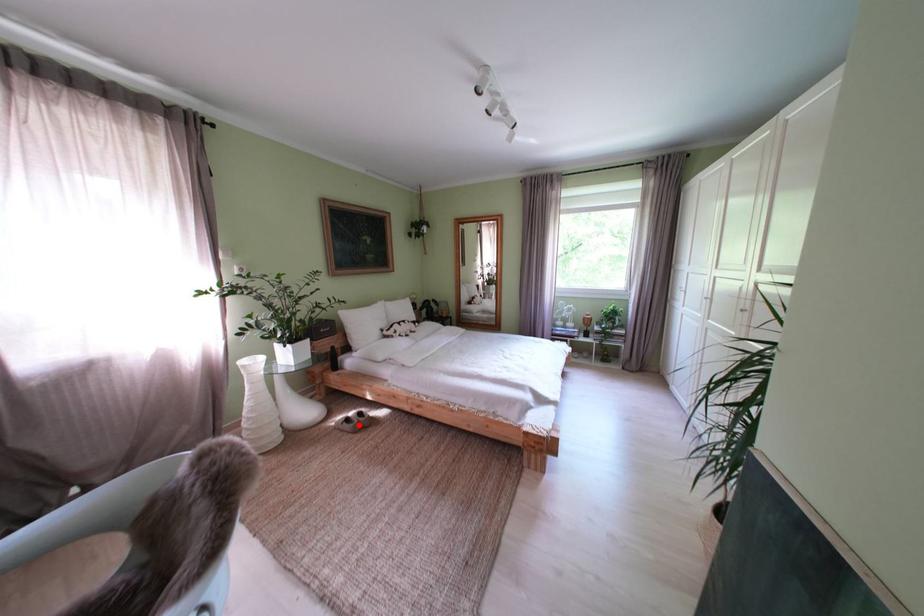
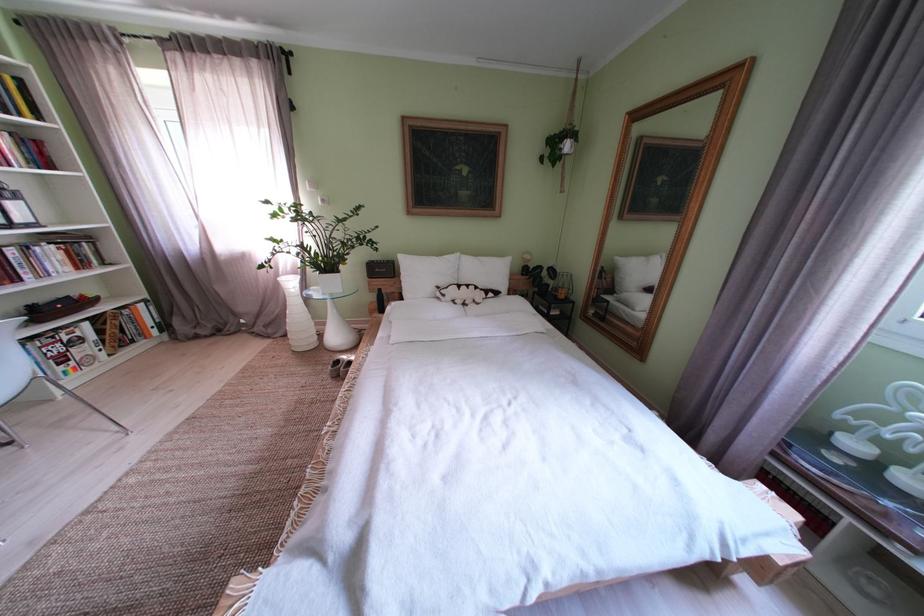
Question: I am providing you with two images of the same scene from different viewpoints. Given a red point in image1, look at the same physical point in image2. Is it:

Choices:
 (A) Closer to the viewpoint
 (B) Farther from the viewpoint

Answer: (B)